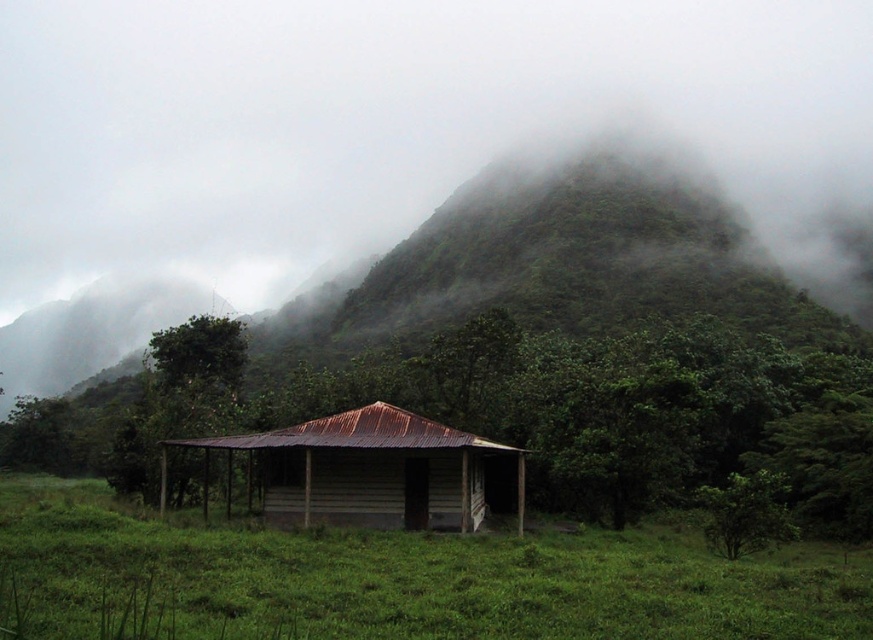
Looking at this image, is green matte/rough hut at center taller than green grassy at center?

Yes.

Between green matte/rough hut at center and green grassy at center, which one has more height?

Standing taller between the two is green matte/rough hut at center.

Image resolution: width=873 pixels, height=640 pixels. I want to click on green matte/rough hut at center, so click(514, 412).

Does green matte/rough hut at center appear on the right side of green matte mountain at center?

Yes, green matte/rough hut at center is to the right of green matte mountain at center.

Who is higher up, green matte/rough hut at center or green matte mountain at center?

green matte mountain at center is above.

The image size is (873, 640). What do you see at coordinates (514, 412) in the screenshot? I see `green matte/rough hut at center` at bounding box center [514, 412].

Locate an element on the screen. green matte/rough hut at center is located at coordinates (514, 412).

Between point (782, 557) and point (390, 424), which one is positioned behind?

The point (390, 424) is more distant.

Which is above, green grassy at center or rusty corrugated metal cabin at center?

Positioned higher is rusty corrugated metal cabin at center.

Is point (716, 628) less distant than point (459, 513)?

That is True.

The width and height of the screenshot is (873, 640). I want to click on green grassy at center, so click(417, 579).